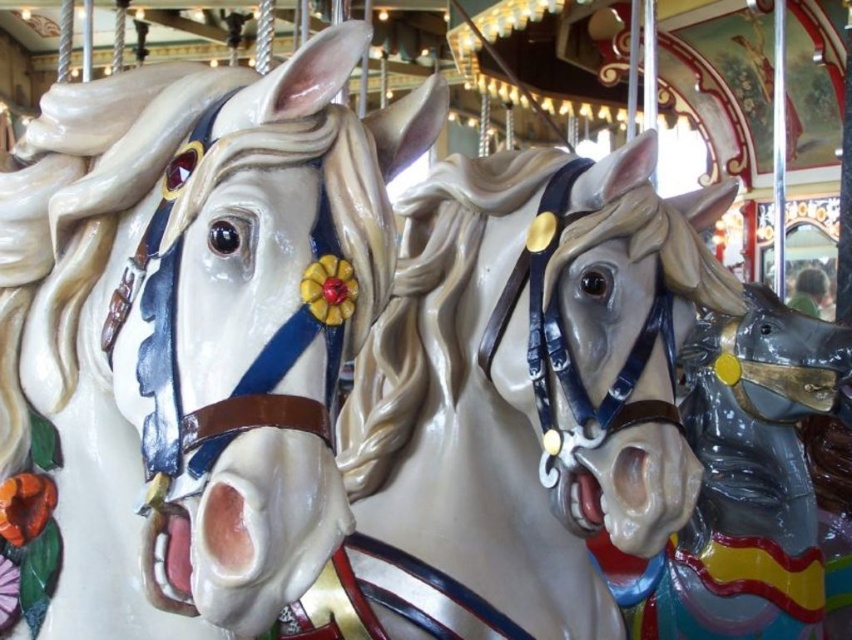
You are a photographer trying to capture the perfect shot of the matte white horse at center and the shiny gold bridle at center. Which object should you focus on first if you want to ensure both are in sharp focus, considering their sizes?

The matte white horse at center has a lesser height compared to shiny gold bridle at center, so you should focus on the shiny gold bridle at center first since it is larger and requires more precise focus to capture details.